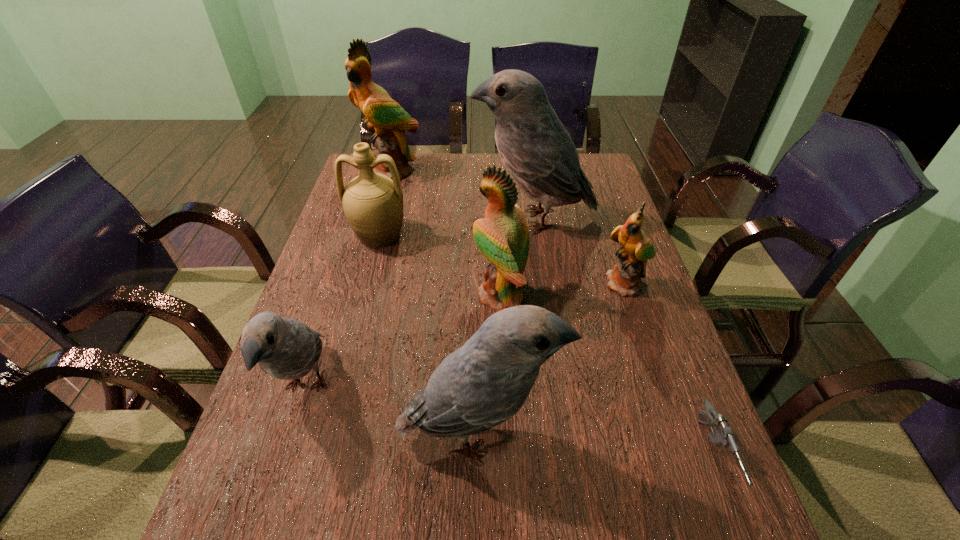
This screenshot has width=960, height=540. I want to click on the biggest gray parrot, so click(535, 147).

Locate an element on the screen. The image size is (960, 540). the fifth nearest parrot is located at coordinates (535, 147).

This screenshot has width=960, height=540. Find the location of `the farthest parrot`. the farthest parrot is located at coordinates (384, 117).

This screenshot has width=960, height=540. Find the location of `the leftmost green parrot`. the leftmost green parrot is located at coordinates (384, 117).

Locate an element on the screen. the second biggest green parrot is located at coordinates (502, 236).

The width and height of the screenshot is (960, 540). I want to click on the second smallest gray parrot, so click(485, 382).

Identify the location of pitcher. (373, 203).

Identify the location of the rightmost green parrot. The image size is (960, 540). (625, 278).

Find the location of `the leftmost gray parrot`. the leftmost gray parrot is located at coordinates (286, 349).

Find the location of `the shortest object`. the shortest object is located at coordinates (723, 436).